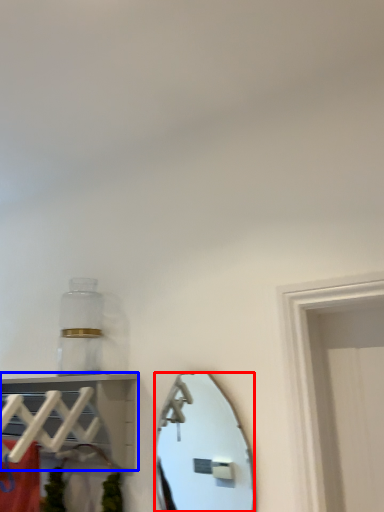
Question: Which object is further to the camera taking this photo, mirror (highlighted by a red box) or shelf (highlighted by a blue box)?

Choices:
 (A) mirror
 (B) shelf

Answer: (A)